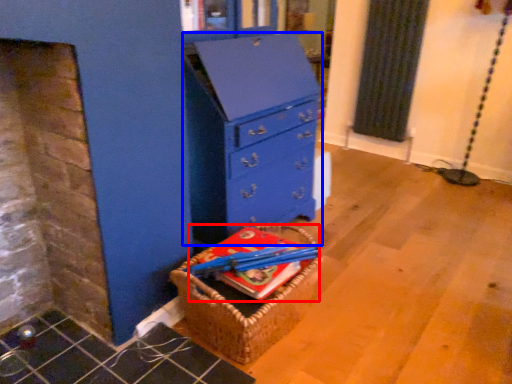
Question: Which point is closer to the camera, book (highlighted by a red box) or chest of drawers (highlighted by a blue box)?

Choices:
 (A) book
 (B) chest of drawers

Answer: (A)